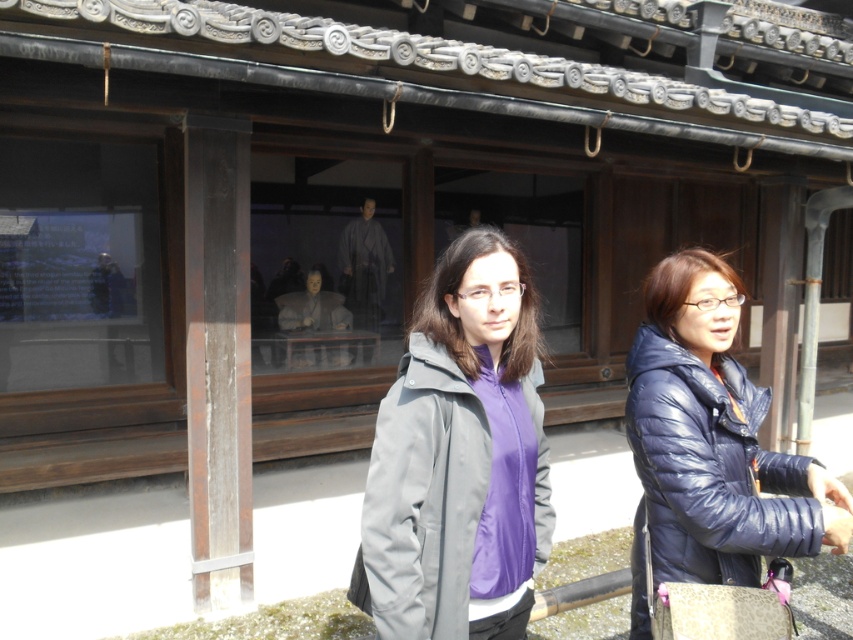
Question: Where is matte gray jacket at center located in relation to glossy blue jacket at right in the image?

Choices:
 (A) right
 (B) left

Answer: (B)

Question: Which point appears farthest from the camera in this image?

Choices:
 (A) [770, 474]
 (B) [366, 605]

Answer: (A)

Question: Is matte gray jacket at center positioned in front of glossy blue jacket at right?

Choices:
 (A) yes
 (B) no

Answer: (A)

Question: Can you confirm if matte gray jacket at center is positioned below glossy blue jacket at right?

Choices:
 (A) no
 (B) yes

Answer: (A)

Question: Among these points, which one is nearest to the camera?

Choices:
 (A) (660, 298)
 (B) (498, 252)

Answer: (B)